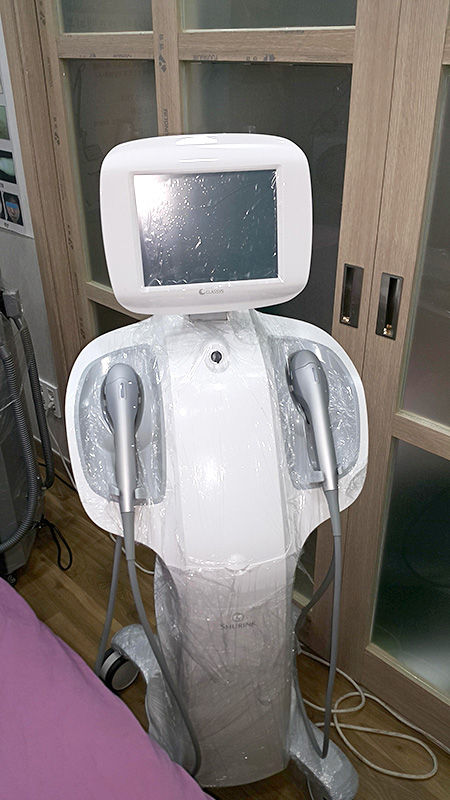
Where is `protective plastic sheet over medical machine`? protective plastic sheet over medical machine is located at coordinates (165, 610), (159, 446), (294, 418), (212, 266).